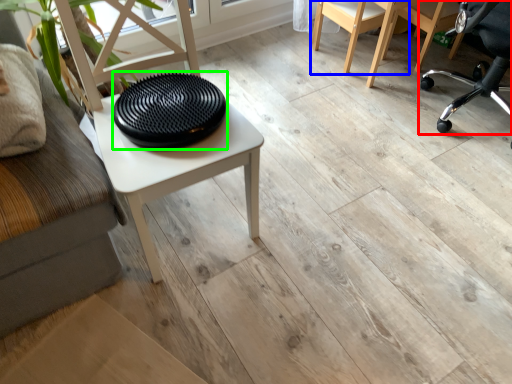
Question: Which object is positioned closest to chair (highlighted by a red box)? Select from chair (highlighted by a blue box) and tray (highlighted by a green box).

Choices:
 (A) chair
 (B) tray

Answer: (A)